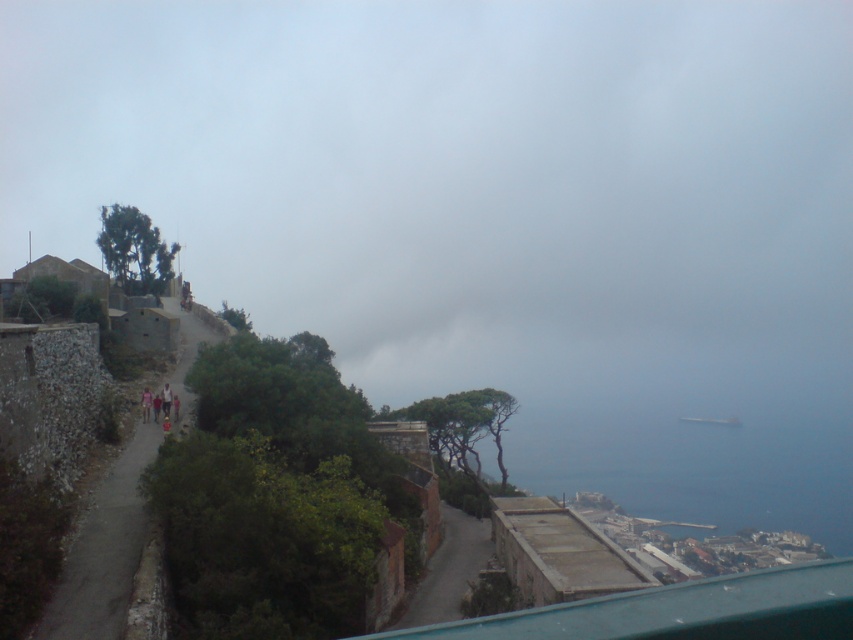
You are a hiker on the narrow pathway through greenery bordered by stone walls. You want to reach the blue water at lower right but need to navigate around the gray fog at upper center. Which direction should you move to avoid the fog and head toward the water?

The gray fog at upper center is positioned over the blue water at lower right, so to avoid the fog and head toward the blue water at lower right, you should move downward along the path away from the fog.

You are standing at the point with coordinates (469, 186) in the coastal scene. What do you see there?

At point (469, 186) lies gray fog at upper center.